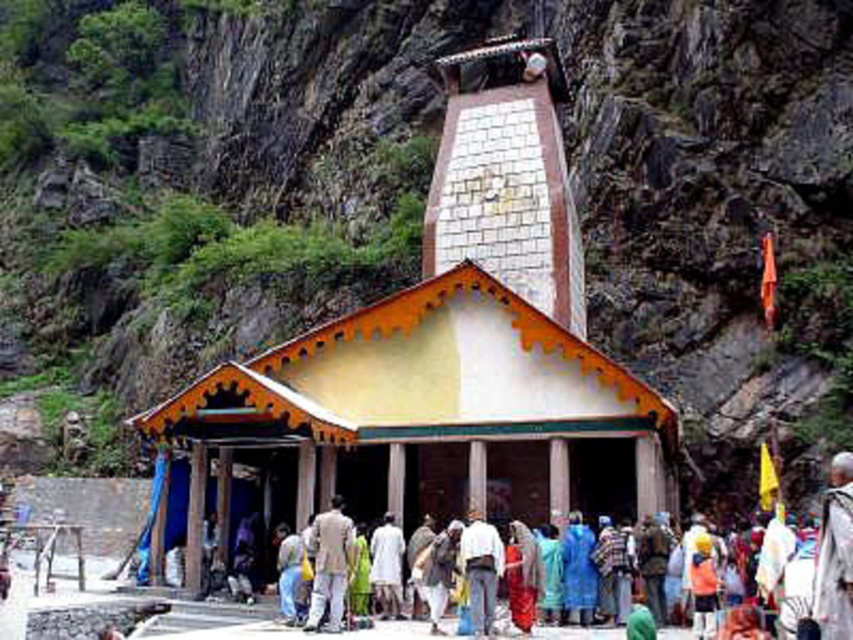
Can you confirm if white fabric at center is positioned below light brown fabric jacket at center?

No.

Between white fabric at center and light brown fabric jacket at center, which one appears on the left side from the viewer's perspective?

From the viewer's perspective, light brown fabric jacket at center appears more on the left side.

The width and height of the screenshot is (853, 640). Describe the element at coordinates (834, 554) in the screenshot. I see `white fabric at center` at that location.

Identify the location of white fabric at center. (834, 554).

Describe the element at coordinates (447, 352) in the screenshot. I see `white stone temple at center` at that location.

Does white stone temple at center have a greater width compared to light brown fabric jacket at center?

Indeed, white stone temple at center has a greater width compared to light brown fabric jacket at center.

What do you see at coordinates (447, 352) in the screenshot?
I see `white stone temple at center` at bounding box center [447, 352].

Identify the location of white stone temple at center. This screenshot has width=853, height=640. 447,352.

Who is shorter, white stone temple at center or white fabric at center?

With less height is white fabric at center.

Can you confirm if white stone temple at center is positioned to the left of white fabric at center?

Yes, white stone temple at center is to the left of white fabric at center.

Measure the distance between point (496, 456) and camera.

179.53 feet

The width and height of the screenshot is (853, 640). Find the location of `white stone temple at center`. white stone temple at center is located at coordinates (447, 352).